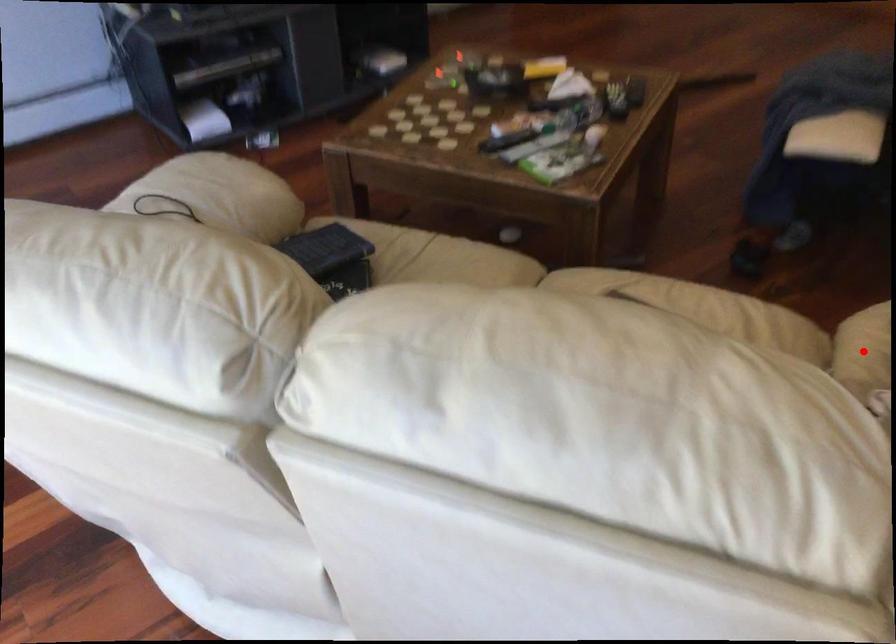
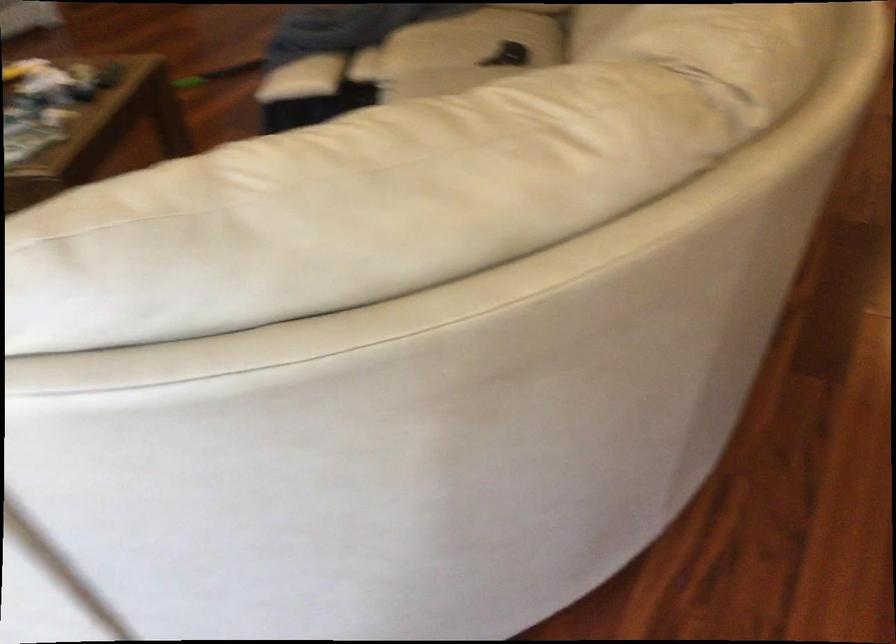
Question: I am providing you with two images of the same scene from different viewpoints. A red point is marked on the first image. At the location where the point appears in image 1, is it still visible in image 2?

Choices:
 (A) Yes
 (B) No

Answer: (B)